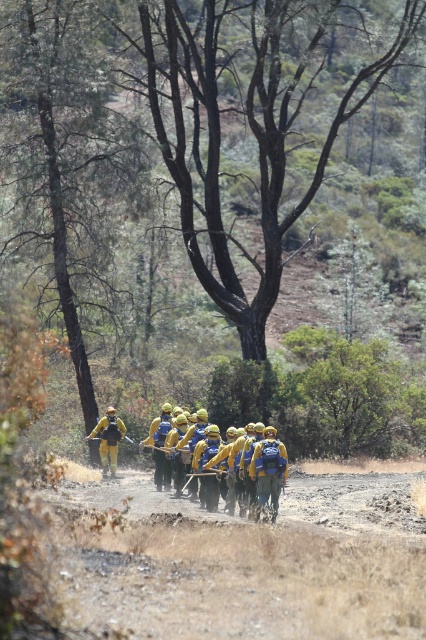
Question: Can you confirm if yellow fabric uniform at center is positioned below yellow reflective uniform at center?

Choices:
 (A) no
 (B) yes

Answer: (A)

Question: Does yellow fabric uniform at center appear over yellow reflective uniform at center?

Choices:
 (A) no
 (B) yes

Answer: (B)

Question: Does yellow fabric uniform at center have a smaller size compared to yellow reflective uniform at center?

Choices:
 (A) no
 (B) yes

Answer: (A)